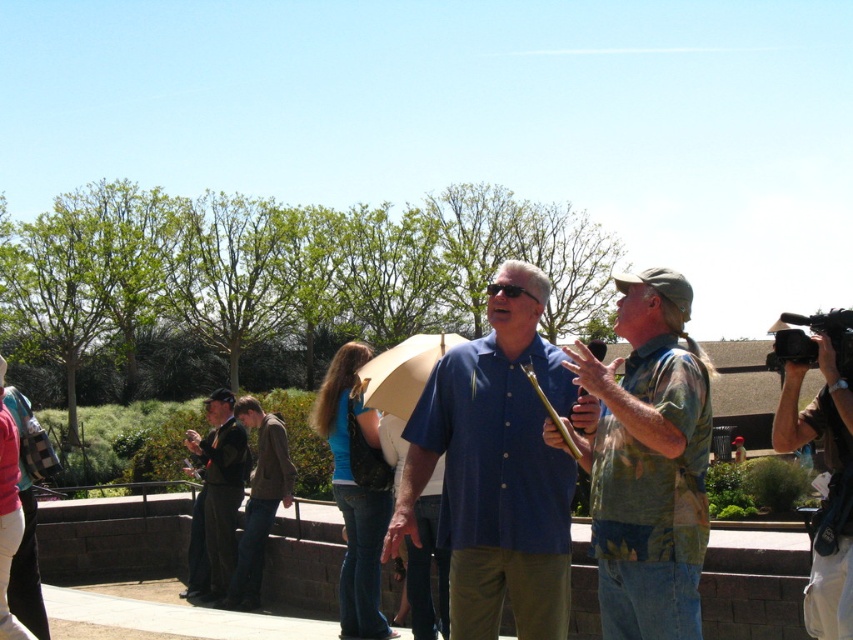
You are a photographer standing in the park and want to take a photo of both the blue shirt at center and the dark blue uniform at center. Since you can only focus on one person at a time, which one should you focus on first if you want to capture them in order from left to right?

The dark blue uniform at center should be focused on first since it is to the left of the blue shirt at center.